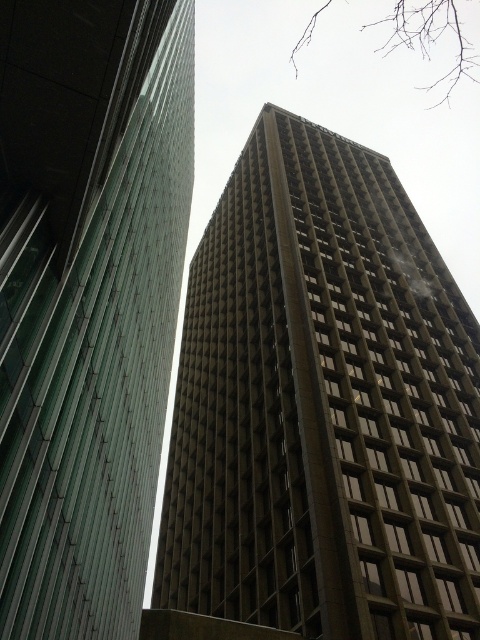
Between brown concrete building at center and green glass building at left, which one is positioned higher?

green glass building at left is above.

Is point (344, 424) less distant than point (139, 596)?

No, (344, 424) is behind (139, 596).

Where is `brown concrete building at center`? This screenshot has height=640, width=480. brown concrete building at center is located at coordinates (323, 406).